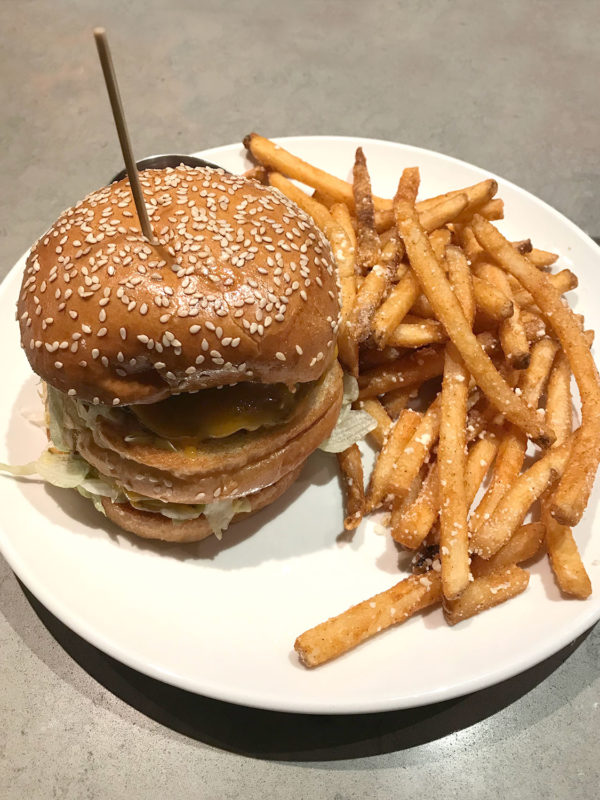
I want to click on plate, so click(149, 632).